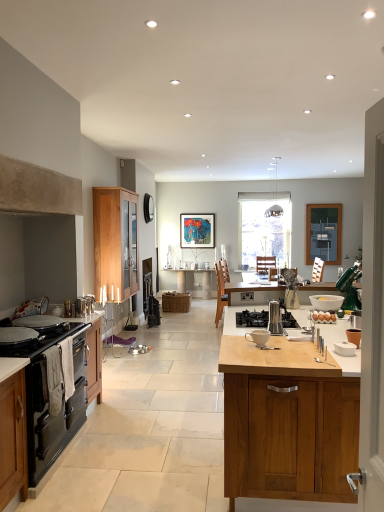
Question: Considering their positions, is satin nickel faucet at center, the 4th appliance positioned from the front, located in front of or behind metallic silver kettle at left, which appears as the fifth appliance when viewed from the right?

Choices:
 (A) behind
 (B) front

Answer: (A)

Question: Based on their sizes in the image, would you say satin nickel faucet at center, the 4th appliance positioned from the front, is bigger or smaller than metallic silver kettle at left, the third appliance in the front-to-back sequence?

Choices:
 (A) small
 (B) big

Answer: (A)

Question: Based on their relative distances, which object is farther from the stainless steel gas stove at center, the 2th gas stove from the left?

Choices:
 (A) black matte oven at left, which ranks as the fifth appliance in back-to-front order
 (B) black matte gas stove at left, the second gas stove positioned from the right
 (C) white ceramic cup at center
 (D) woven brown picnic basket at center
 (E) wooden cabinet at right, which is the first cabinetry from right to left

Answer: (D)

Question: Estimate the real-world distances between objects in this image. Which object is closer to the woven brown picnic basket at center?

Choices:
 (A) black matte stove at left
 (B) black matte oven at left, placed as the 3th cabinetry when sorted from right to left
 (C) metallic silver kettle at left, which is the second appliance in left-to-right order
 (D) white ceramic cup at center
 (E) satin silver espresso maker at center, which appears as the third appliance when viewed from the right

Answer: (B)